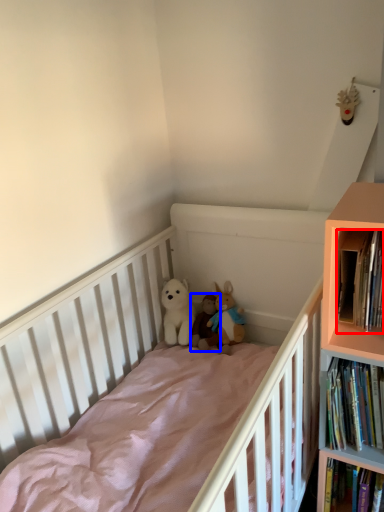
Question: Which object is closer to the camera taking this photo, book (highlighted by a red box) or toy (highlighted by a blue box)?

Choices:
 (A) book
 (B) toy

Answer: (A)